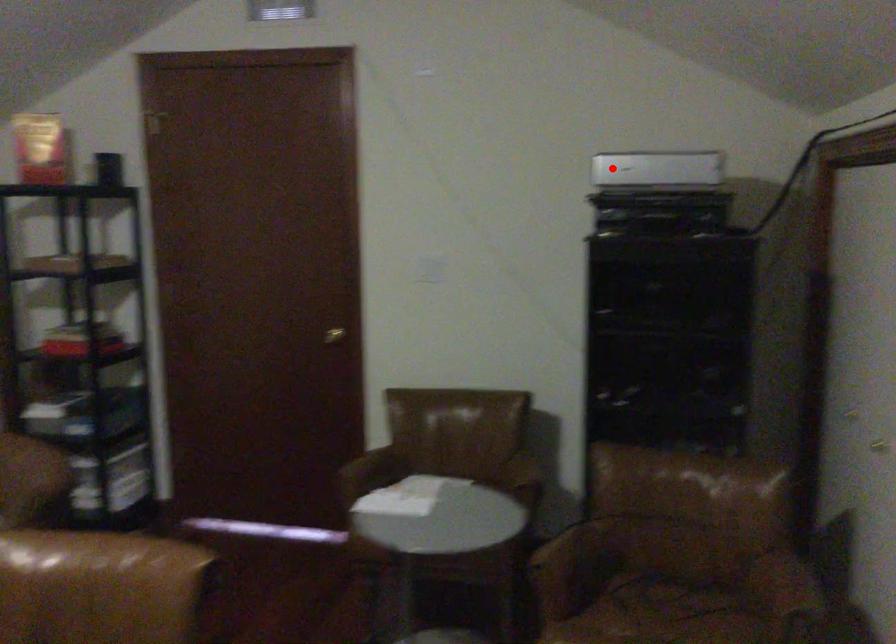
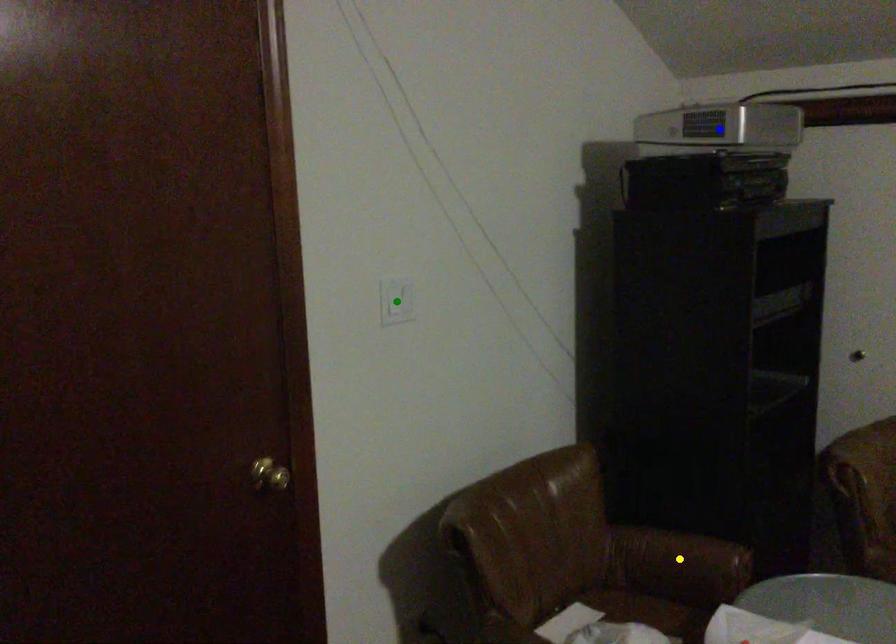
Question: I am providing you with two images of the same scene from different viewpoints. A red point is marked on the first image. You are given multiple points on the second image. Which spot in image 2 lines up with the point in image 1?

Choices:
 (A) yellow point
 (B) blue point
 (C) green point

Answer: (B)